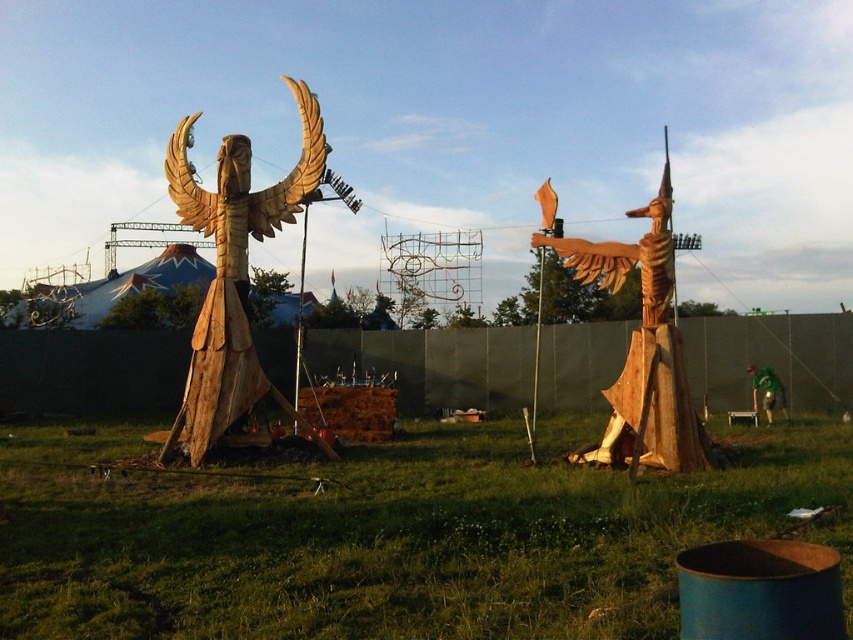
You are a gardener who needs to mow the lawn. You see the green grass at center and the wooden statue at left. Which one is shorter?

The green grass at center is shorter than the wooden statue at left.

You are planning to place a new bench that is 1.2 meters wide in the outdoor setting. The bench must be placed where there is enough space between the green grass at center and the wooden bird at center. Is there enough space between them for the bench?

The green grass at center has a width less than the wooden bird at center, so the space between them may not be sufficient for a 1.2 meter wide bench. Check the exact measurements before placing it.

You are a gardener who needs to water the green grass at center and the wooden statue at left. Your watering can has a range of 10 feet. Can you water both from your current position without moving?

The distance between the green grass at center and the wooden statue at left is 11.69 feet, which exceeds the watering can range of 10 feet. Therefore, you cannot water both without moving.